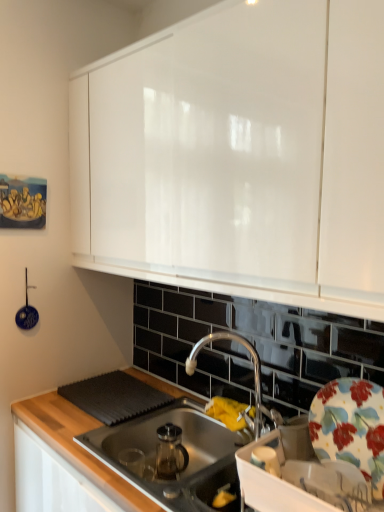
Question: Is blue ceramic ladle at left in front of or behind chrome metallic faucet at center in the image?

Choices:
 (A) behind
 (B) front

Answer: (A)

Question: Considering the positions of point (33, 310) and point (231, 339), is point (33, 310) closer or farther from the camera than point (231, 339)?

Choices:
 (A) closer
 (B) farther

Answer: (B)

Question: Which is nearer to the blue ceramic ladle at left?

Choices:
 (A) floral ceramic plate at right
 (B) white glossy cabinet at upper center
 (C) stainless steel sink at center
 (D) chrome metallic faucet at center

Answer: (C)

Question: Estimate the real-world distances between objects in this image. Which object is closer to the stainless steel sink at center?

Choices:
 (A) blue ceramic ladle at left
 (B) chrome metallic faucet at center
 (C) white glossy cabinet at upper center
 (D) floral ceramic plate at right

Answer: (B)